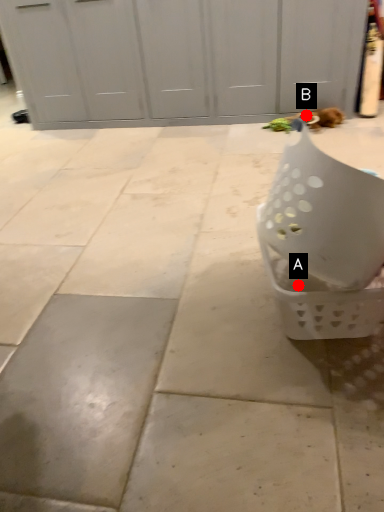
Question: Two points are circled on the image, labeled by A and B beside each circle. Among these points, which one is farthest from the camera?

Choices:
 (A) A is further
 (B) B is further

Answer: (B)